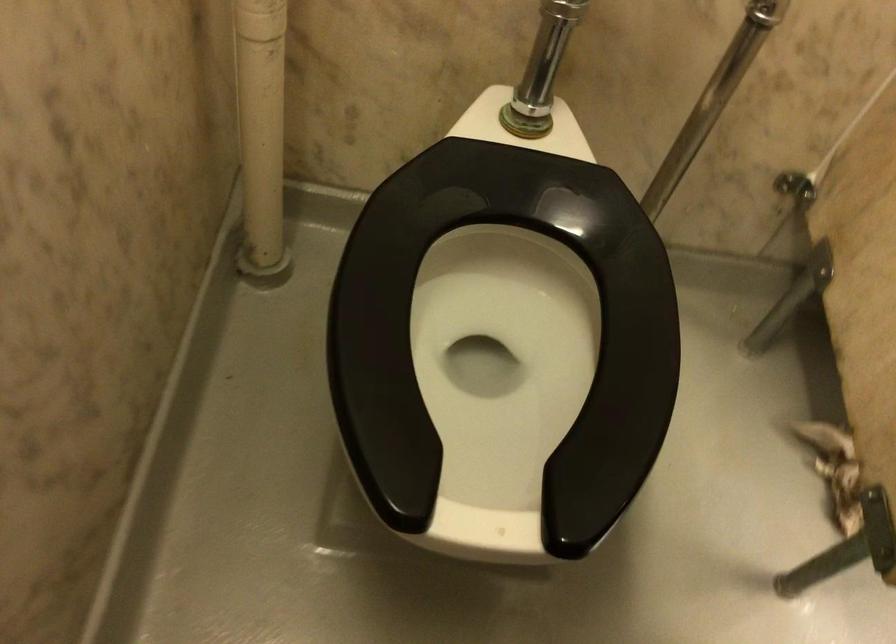
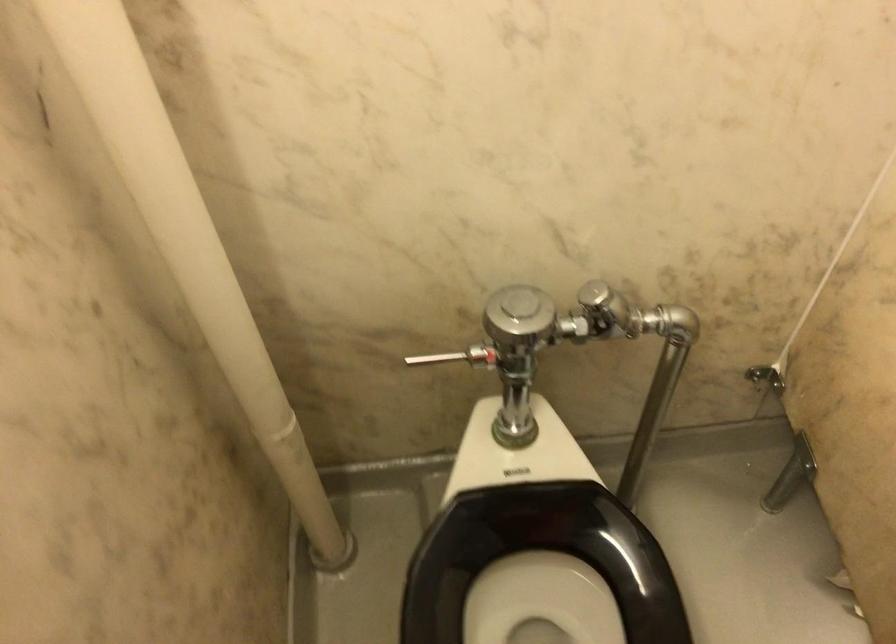
Question: The camera is either moving clockwise (left) or counter-clockwise (right) around the object. The first image is from the beginning of the video and the second image is from the end. Is the camera moving left or right when shooting the video?

Choices:
 (A) Left
 (B) Right

Answer: (B)